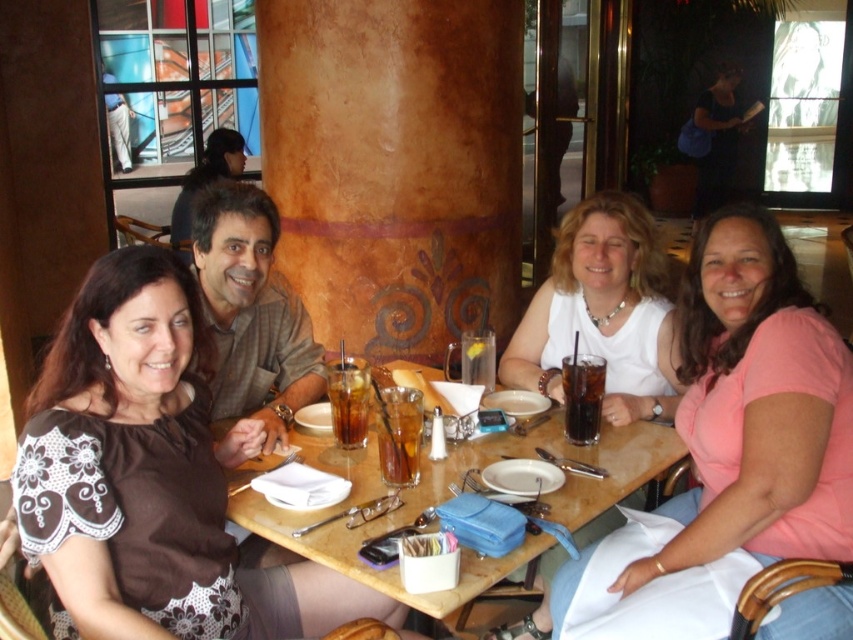
Question: Is white matte shirt at center thinner than wooden table at center?

Choices:
 (A) no
 (B) yes

Answer: (B)

Question: Can you confirm if brown fabric shirt at upper left is bigger than wooden table at center?

Choices:
 (A) no
 (B) yes

Answer: (B)

Question: Based on their relative distances, which object is nearer to the wooden table at center?

Choices:
 (A) white matte shirt at center
 (B) brown fabric shirt at upper left
 (C) translucent glass cup at table center
 (D) matte black shirt at upper left

Answer: (C)

Question: Can you confirm if pink matte shirt at center is positioned to the right of wooden table at center?

Choices:
 (A) no
 (B) yes

Answer: (B)

Question: Considering the real-world distances, which object is closest to the pink matte shirt at center?

Choices:
 (A) dark brown glass at table center
 (B) brown fabric shirt at upper left

Answer: (A)

Question: Which point is closer to the camera?

Choices:
 (A) brown fabric shirt at upper left
 (B) wooden table at center

Answer: (A)